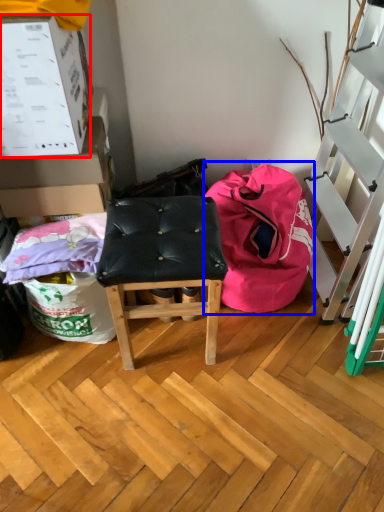
Question: Which object appears farthest to the camera in this image, box (highlighted by a red box) or bean bag chair (highlighted by a blue box)?

Choices:
 (A) box
 (B) bean bag chair

Answer: (B)